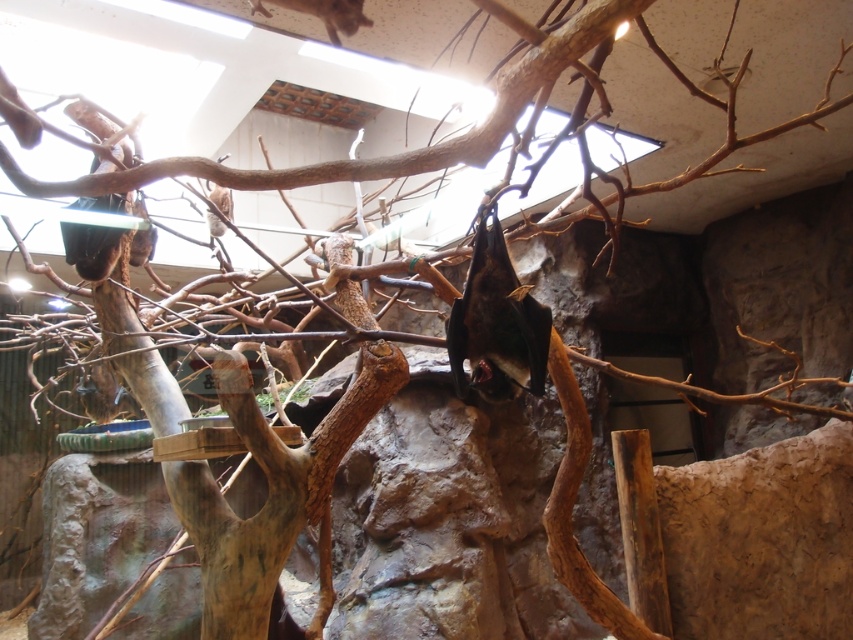
Question: Among these objects, which one is nearest to the camera?

Choices:
 (A) dark brown fur bat at center
 (B) brown fur bat at upper center

Answer: (B)

Question: Observing the image, what is the correct spatial positioning of dark brown fur bat at center in reference to brown fur bat at upper center?

Choices:
 (A) below
 (B) above

Answer: (A)

Question: Where is dark brown fur bat at center located in relation to brown fur bat at upper center in the image?

Choices:
 (A) above
 (B) below

Answer: (B)

Question: Where is dark brown fur bat at center located in relation to brown fur bat at upper center in the image?

Choices:
 (A) below
 (B) above

Answer: (A)